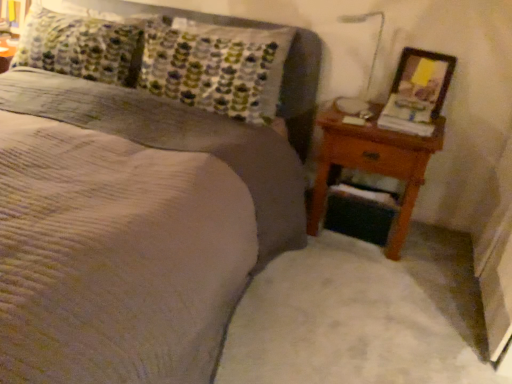
Question: Does brown wooden nightstand at right turn towards wooden picture frame at right?

Choices:
 (A) yes
 (B) no

Answer: (B)

Question: Is wooden picture frame at right surrounded by brown wooden nightstand at right?

Choices:
 (A) yes
 (B) no

Answer: (B)

Question: From the image's perspective, is brown wooden nightstand at right on top of wooden picture frame at right?

Choices:
 (A) no
 (B) yes

Answer: (A)

Question: Can you confirm if brown wooden nightstand at right is wider than wooden picture frame at right?

Choices:
 (A) no
 (B) yes

Answer: (B)

Question: Is brown wooden nightstand at right not inside wooden picture frame at right?

Choices:
 (A) no
 (B) yes

Answer: (B)

Question: Is brown wooden nightstand at right bigger than wooden picture frame at right?

Choices:
 (A) yes
 (B) no

Answer: (A)

Question: From a real-world perspective, is wooden picture frame at right over textured gray bed at center?

Choices:
 (A) yes
 (B) no

Answer: (A)

Question: Can you confirm if wooden picture frame at right is positioned to the right of textured gray bed at center?

Choices:
 (A) no
 (B) yes

Answer: (B)

Question: Is wooden picture frame at right facing away from textured gray bed at center?

Choices:
 (A) yes
 (B) no

Answer: (B)

Question: From the image's perspective, is wooden picture frame at right located beneath textured gray bed at center?

Choices:
 (A) no
 (B) yes

Answer: (A)

Question: Considering the relative sizes of wooden picture frame at right and textured gray bed at center in the image provided, is wooden picture frame at right taller than textured gray bed at center?

Choices:
 (A) no
 (B) yes

Answer: (A)

Question: From the image's perspective, is wooden picture frame at right above textured gray bed at center?

Choices:
 (A) yes
 (B) no

Answer: (A)

Question: Considering the relative positions of brown wooden nightstand at right and textured gray bed at center in the image provided, is brown wooden nightstand at right to the left of textured gray bed at center from the viewer's perspective?

Choices:
 (A) no
 (B) yes

Answer: (A)